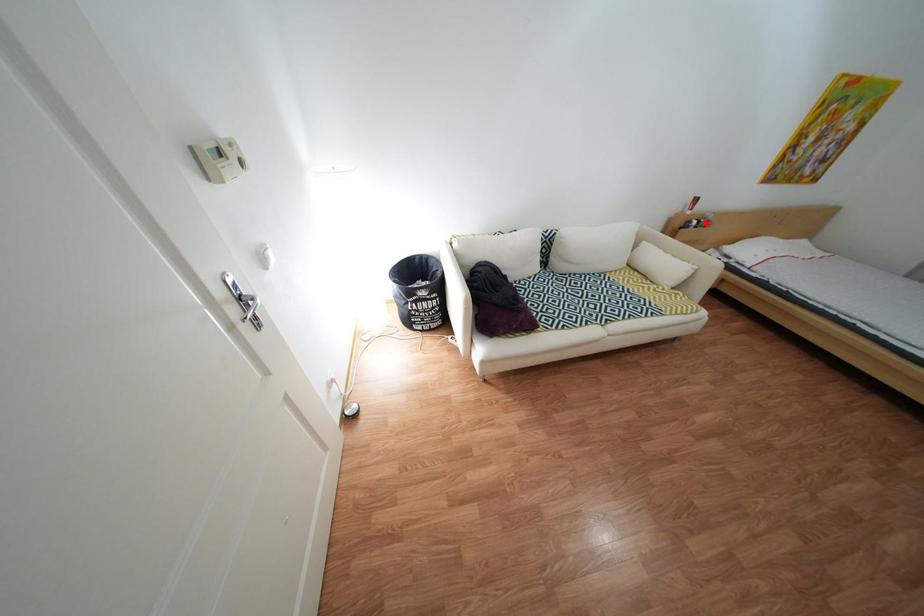
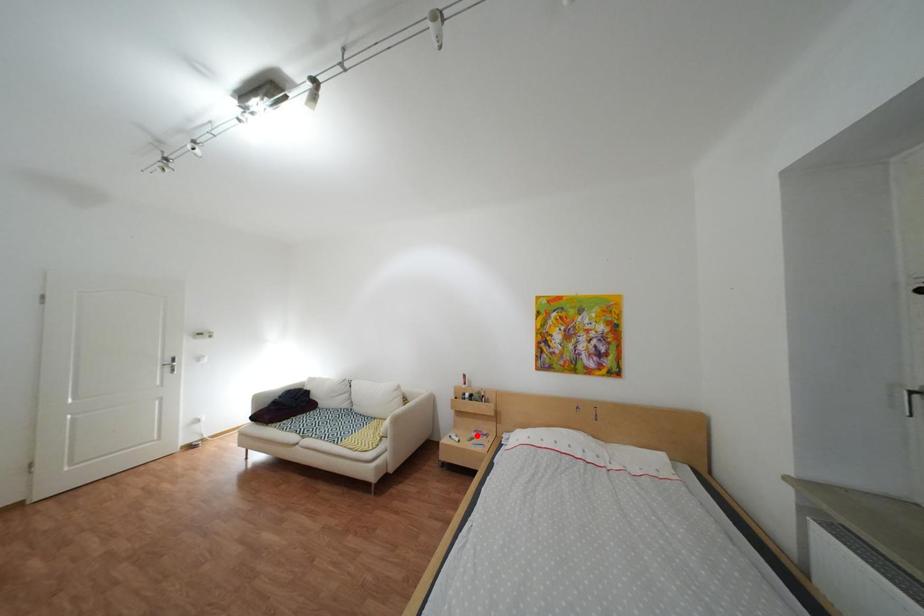
I am providing you with two images of the same scene from different viewpoints. A red point is marked on the first image and another point is marked on the second image. Is the marked point in image1 the same physical position as the marked point in image2?

No